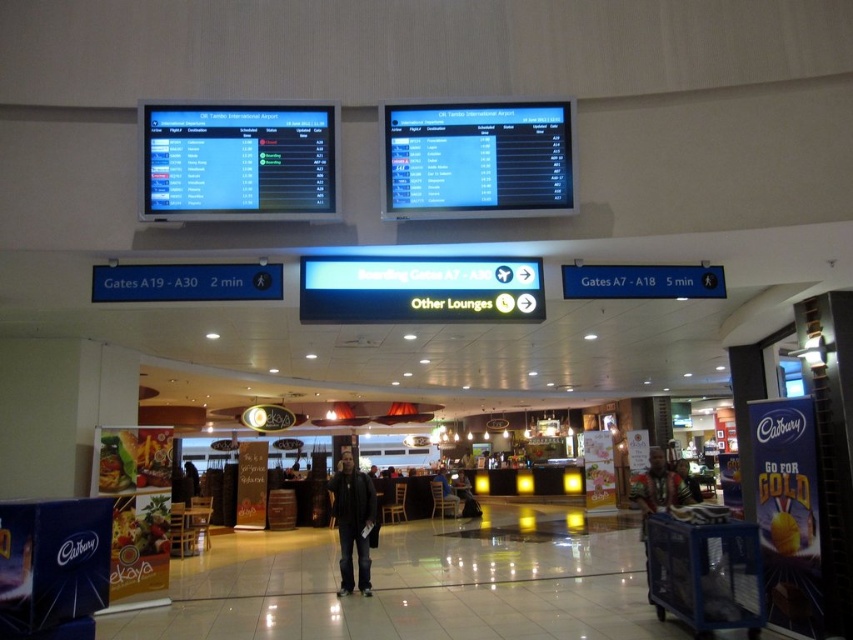
Question: Does dark gray jacket at center appear on the right side of wooden tribal mask at center?

Choices:
 (A) yes
 (B) no

Answer: (B)

Question: Among these points, which one is farthest from the camera?

Choices:
 (A) (341, 588)
 (B) (660, 456)

Answer: (A)

Question: Is dark gray jacket at center above wooden tribal mask at center?

Choices:
 (A) yes
 (B) no

Answer: (A)

Question: Does dark gray jacket at center have a smaller size compared to wooden tribal mask at center?

Choices:
 (A) no
 (B) yes

Answer: (B)

Question: Which point appears farthest from the camera in this image?

Choices:
 (A) (660, 449)
 (B) (347, 556)

Answer: (A)